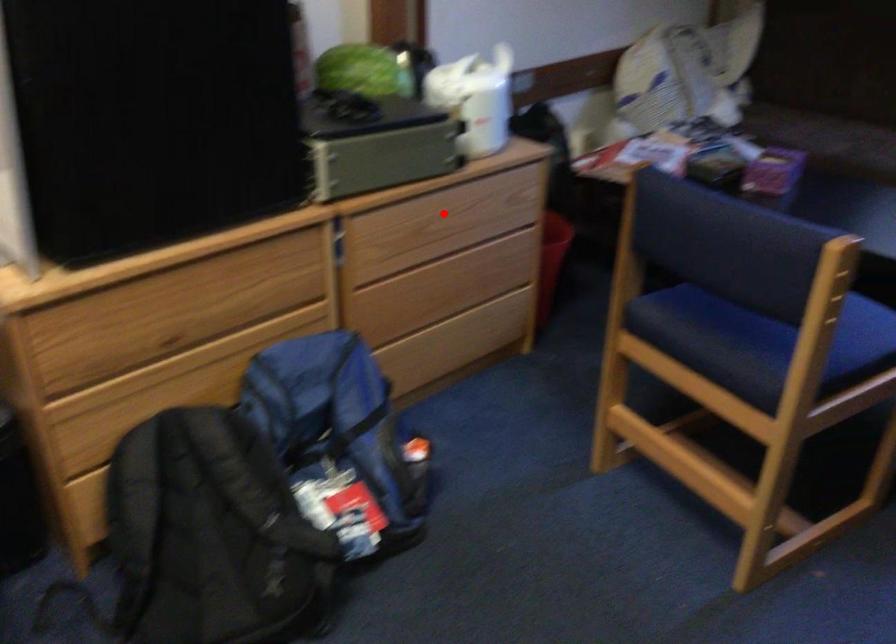
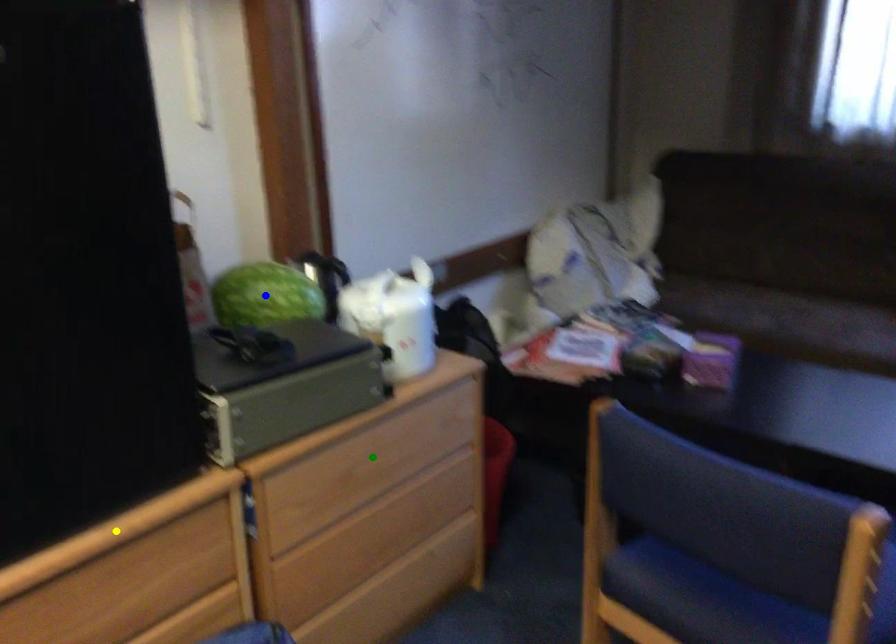
Question: I am providing you with two images of the same scene from different viewpoints. A red point is marked on the first image. You are given multiple points on the second image. In image 2, which mark is for the same physical point as the one in image 1?

Choices:
 (A) yellow point
 (B) blue point
 (C) green point

Answer: (C)